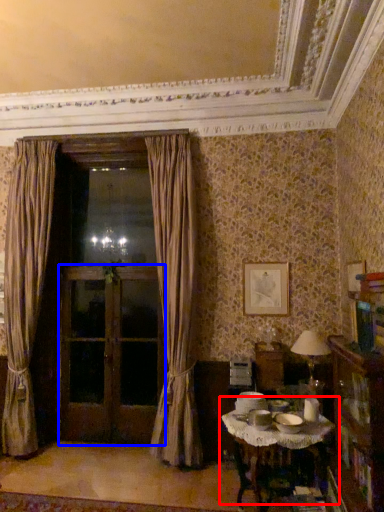
Question: Which object appears farthest to the camera in this image, table (highlighted by a red box) or screen door (highlighted by a blue box)?

Choices:
 (A) table
 (B) screen door

Answer: (B)